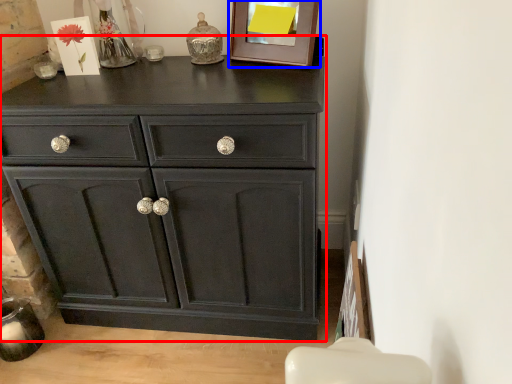
Question: Among these objects, which one is farthest to the camera, chest of drawers (highlighted by a red box) or picture frame (highlighted by a blue box)?

Choices:
 (A) chest of drawers
 (B) picture frame

Answer: (B)